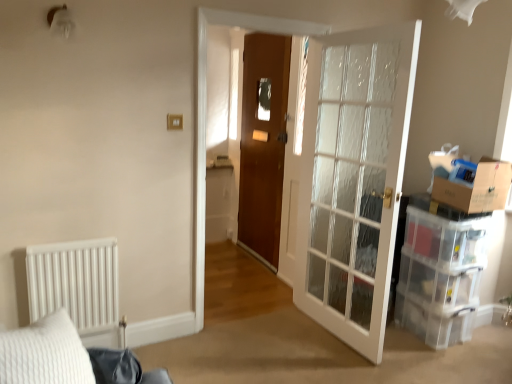
Question: From the image's perspective, is clear glass door at right below brown cardboard box at right?

Choices:
 (A) no
 (B) yes

Answer: (B)

Question: Is clear glass door at right next to brown cardboard box at right?

Choices:
 (A) no
 (B) yes

Answer: (A)

Question: Would you say clear glass door at right is a long distance from brown cardboard box at right?

Choices:
 (A) no
 (B) yes

Answer: (A)

Question: Could you tell me if clear glass door at right is turned towards brown cardboard box at right?

Choices:
 (A) yes
 (B) no

Answer: (A)

Question: Is the depth of clear glass door at right greater than that of brown cardboard box at right?

Choices:
 (A) no
 (B) yes

Answer: (A)

Question: Based on their sizes in the image, would you say clear glass door at right is bigger or smaller than brown cardboard box at right?

Choices:
 (A) big
 (B) small

Answer: (A)

Question: Considering their positions, is clear glass door at right located in front of or behind brown cardboard box at right?

Choices:
 (A) front
 (B) behind

Answer: (A)

Question: From the image's perspective, is clear glass door at right positioned above or below brown cardboard box at right?

Choices:
 (A) below
 (B) above

Answer: (A)

Question: Considering the positions of point (380, 276) and point (494, 190), is point (380, 276) closer or farther from the camera than point (494, 190)?

Choices:
 (A) closer
 (B) farther

Answer: (A)

Question: Considering the relative positions of clear plastic storage box at right and brown cardboard box at right in the image provided, is clear plastic storage box at right to the left or to the right of brown cardboard box at right?

Choices:
 (A) right
 (B) left

Answer: (B)

Question: Is clear plastic storage box at right taller or shorter than brown cardboard box at right?

Choices:
 (A) tall
 (B) short

Answer: (B)

Question: Is point (456, 235) positioned closer to the camera than point (472, 188)?

Choices:
 (A) farther
 (B) closer

Answer: (A)

Question: From a real-world perspective, relative to brown cardboard box at right, is clear plastic storage box at right vertically above or below?

Choices:
 (A) below
 (B) above

Answer: (A)

Question: Considering their positions, is clear plastic storage box at right located in front of or behind clear glass door at right?

Choices:
 (A) front
 (B) behind

Answer: (B)

Question: In terms of height, does clear plastic storage box at right look taller or shorter compared to clear glass door at right?

Choices:
 (A) tall
 (B) short

Answer: (B)